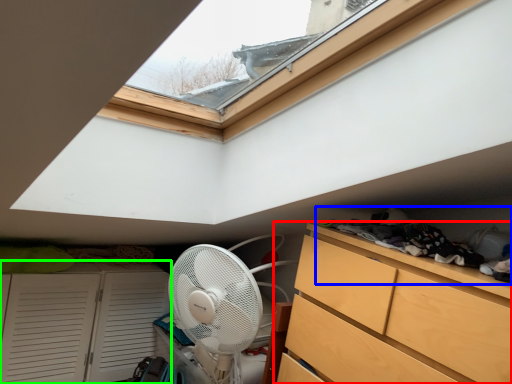
Question: Estimate the real-world distances between objects in this image. Which object is farther from chest of drawers (highlighted by a red box), laundry (highlighted by a blue box) or cupboard (highlighted by a green box)?

Choices:
 (A) laundry
 (B) cupboard

Answer: (B)